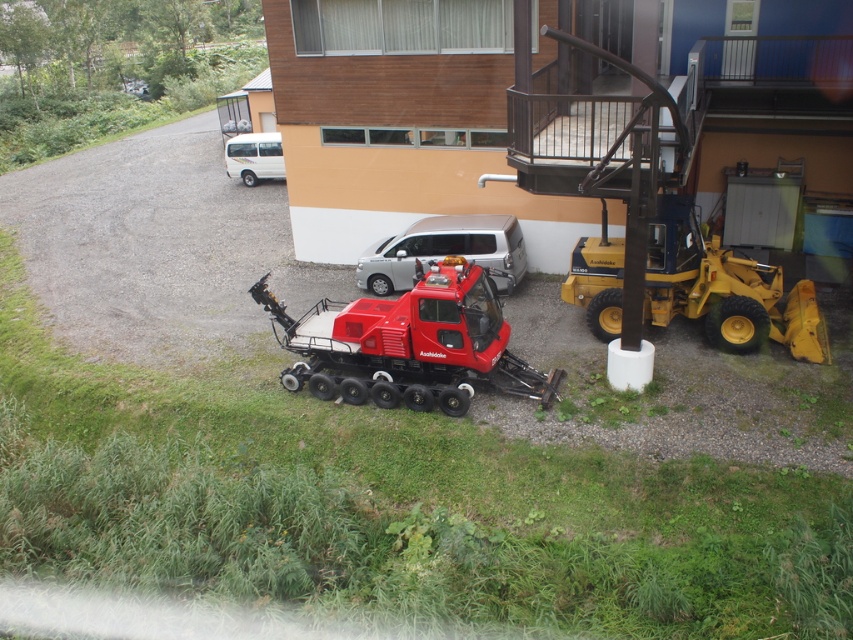
Does matte red snowcat at center appear over yellow rubber tractor at right?

No, matte red snowcat at center is not above yellow rubber tractor at right.

Who is more forward, (x=341, y=358) or (x=677, y=284)?

Point (x=341, y=358) is more forward.

The image size is (853, 640). What are the coordinates of `matte red snowcat at center` in the screenshot? It's located at (408, 342).

Is matte red snowcat at center to the left of white matte van at upper center from the viewer's perspective?

In fact, matte red snowcat at center is to the right of white matte van at upper center.

Does matte red snowcat at center have a greater height compared to white matte van at upper center?

Yes, matte red snowcat at center is taller than white matte van at upper center.

Which is in front, point (457, 316) or point (271, 170)?

Point (457, 316) is more forward.

The width and height of the screenshot is (853, 640). I want to click on matte red snowcat at center, so click(408, 342).

Who is positioned more to the right, yellow rubber tractor at right or white matte van at upper center?

From the viewer's perspective, yellow rubber tractor at right appears more on the right side.

Is yellow rubber tractor at right in front of white matte van at upper center?

Yes, yellow rubber tractor at right is in front of white matte van at upper center.

Identify the location of yellow rubber tractor at right. Image resolution: width=853 pixels, height=640 pixels. (724, 289).